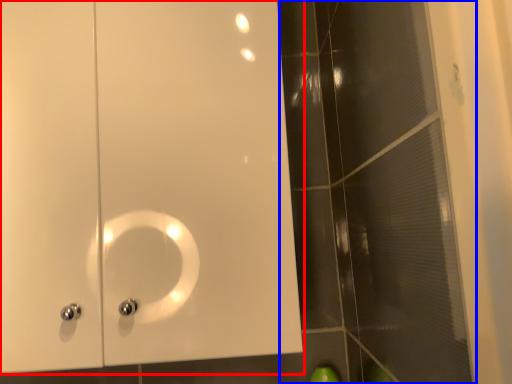
Question: Which object is closer to the camera taking this photo, door (highlighted by a red box) or glass door (highlighted by a blue box)?

Choices:
 (A) door
 (B) glass door

Answer: (B)